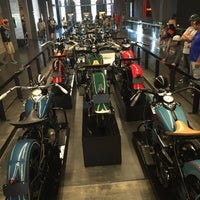
You are a GUI agent. You are given a task and a screenshot of the screen. Output one action in this format:
    pyautogui.click(x=<x>, y=<y>)
    Task: Click on the window
    This screenshot has width=200, height=200.
    Given the screenshot: What is the action you would take?
    pyautogui.click(x=77, y=10)